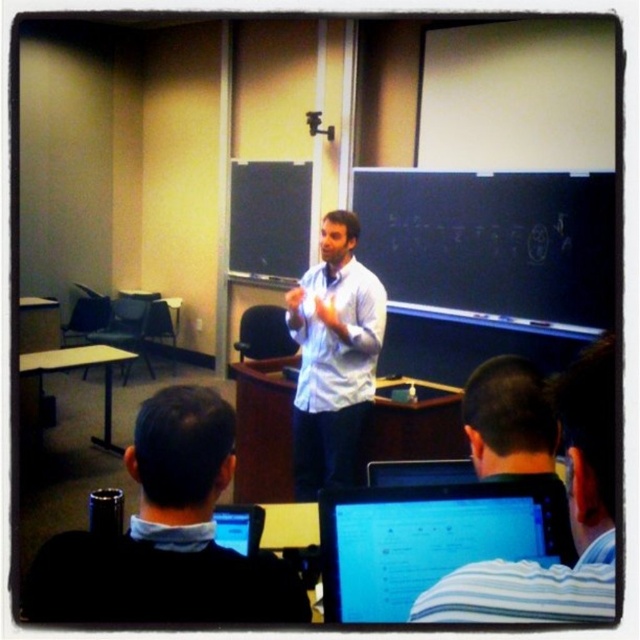
Question: Does striped shirt at center have a larger size compared to white shirt at center?

Choices:
 (A) no
 (B) yes

Answer: (A)

Question: Is black sweater at lower left below matte black monitor at lower center?

Choices:
 (A) no
 (B) yes

Answer: (A)

Question: Is matte black monitor at lower center wider than white shirt at center?

Choices:
 (A) no
 (B) yes

Answer: (A)

Question: Among these points, which one is farthest from the camera?

Choices:
 (A) (355, 412)
 (B) (500, 518)

Answer: (A)

Question: Among these objects, which one is farthest from the camera?

Choices:
 (A) black sweater at lower left
 (B) white shirt at center
 (C) striped shirt at center

Answer: (B)

Question: Which is nearer to the white shirt at center?

Choices:
 (A) black sweater at lower left
 (B) striped shirt at center
 (C) matte black monitor at lower center

Answer: (C)